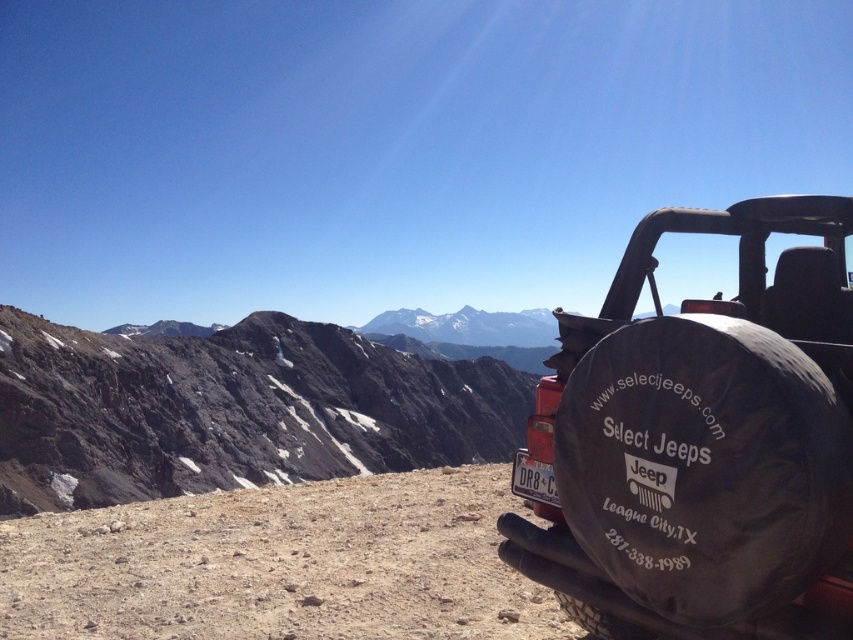
Looking at this image, is black rubber tire at right wider than white plastic license plate at center?

Indeed, black rubber tire at right has a greater width compared to white plastic license plate at center.

Which is more to the right, black rubber tire at right or white plastic license plate at center?

Positioned to the right is black rubber tire at right.

Identify the location of black rubber tire at right. Image resolution: width=853 pixels, height=640 pixels. (708, 440).

Can you confirm if rugged stone mountain at center is positioned to the right of white plastic license plate at center?

In fact, rugged stone mountain at center is to the left of white plastic license plate at center.

Is point (113, 484) less distant than point (534, 477)?

No.

Is point (35, 480) positioned behind point (529, 497)?

That is True.

Where is `rugged stone mountain at center`? rugged stone mountain at center is located at coordinates (233, 410).

Between black rubber tire at right and rugged stone mountain at center, which one is positioned lower?

rugged stone mountain at center is lower down.

Who is more forward, (688, 362) or (329, 451)?

Positioned in front is point (688, 362).

Identify the location of black rubber tire at right. (708, 440).